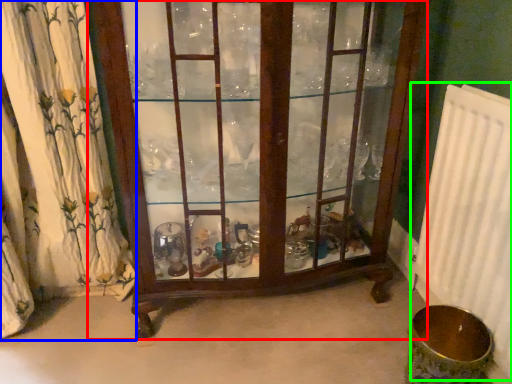
Question: Based on their relative distances, which object is nearer to furniture (highlighted by a red box)? Choose from curtain (highlighted by a blue box) and radiator (highlighted by a green box).

Choices:
 (A) curtain
 (B) radiator

Answer: (A)